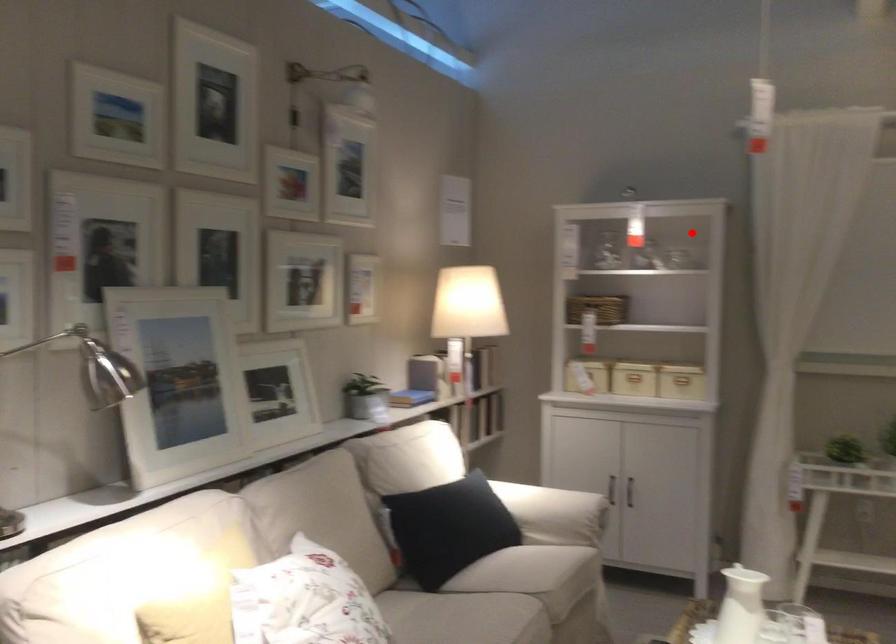
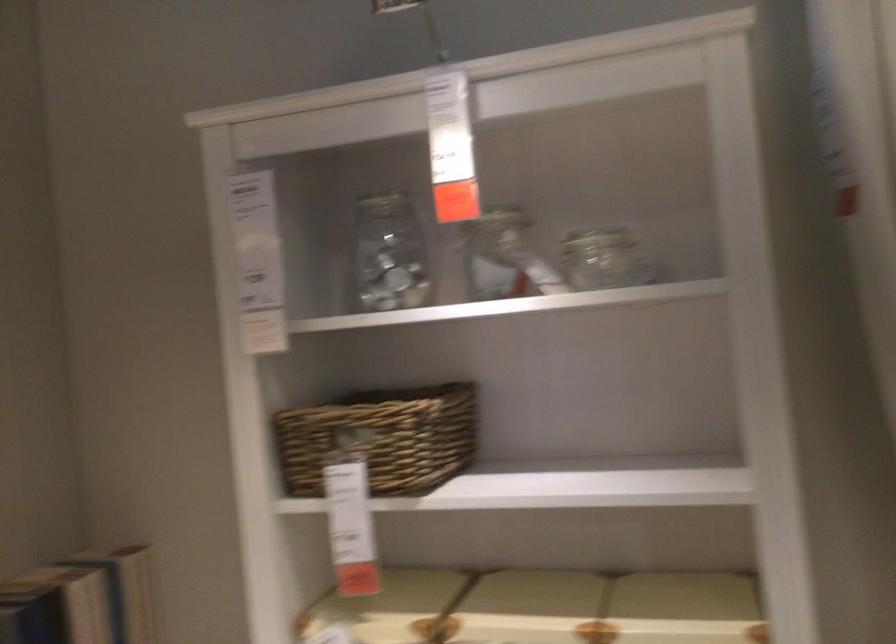
Where in the second image is the point corresponding to the highlighted location from the first image?

(597, 238)